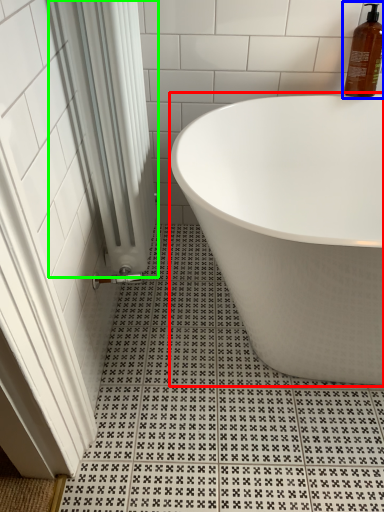
Question: Based on their relative distances, which object is nearer to bathtub (highlighted by a red box)? Choose from cleaning product (highlighted by a blue box) and shower curtain (highlighted by a green box).

Choices:
 (A) cleaning product
 (B) shower curtain

Answer: (B)